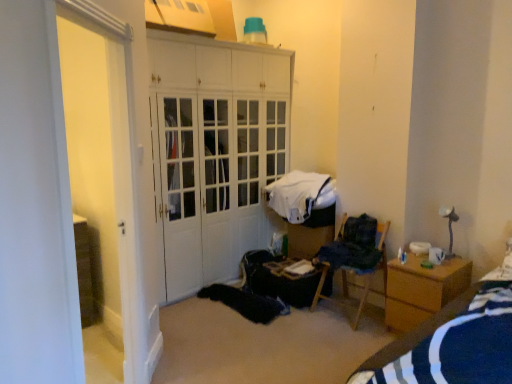
Question: From a real-world perspective, is wooden table at center over white glossy door at left?

Choices:
 (A) no
 (B) yes

Answer: (A)

Question: Is wooden table at center facing away from white glossy door at left?

Choices:
 (A) no
 (B) yes

Answer: (A)

Question: Is wooden table at center directly adjacent to white glossy door at left?

Choices:
 (A) yes
 (B) no

Answer: (B)

Question: Is wooden table at center shorter than white glossy door at left?

Choices:
 (A) no
 (B) yes

Answer: (B)

Question: Considering the relative positions of wooden table at center and white glossy door at left in the image provided, is wooden table at center in front of white glossy door at left?

Choices:
 (A) no
 (B) yes

Answer: (A)

Question: Is blue striped fabric at lower right situated inside dark blue fabric at right, positioned as the 1th clothing in front-to-back order, or outside?

Choices:
 (A) inside
 (B) outside

Answer: (B)

Question: Relative to dark blue fabric at right, the second clothing from the back, is blue striped fabric at lower right in front or behind?

Choices:
 (A) front
 (B) behind

Answer: (A)

Question: From a real-world perspective, is blue striped fabric at lower right physically located above or below dark blue fabric at right, the second clothing from the back?

Choices:
 (A) above
 (B) below

Answer: (B)

Question: Considering the positions of blue striped fabric at lower right and dark blue fabric at right, positioned as the 1th clothing in front-to-back order, in the image, is blue striped fabric at lower right taller or shorter than dark blue fabric at right, positioned as the 1th clothing in front-to-back order,?

Choices:
 (A) short
 (B) tall

Answer: (B)

Question: Is point (286, 213) closer or farther from the camera than point (136, 72)?

Choices:
 (A) farther
 (B) closer

Answer: (A)

Question: From the image's perspective, relative to white glossy door at left, is white fabric at center, arranged as the second clothing when viewed from the front, above or below?

Choices:
 (A) above
 (B) below

Answer: (A)

Question: Relative to white glossy door at left, is white fabric at center, arranged as the second clothing when viewed from the front, in front or behind?

Choices:
 (A) front
 (B) behind

Answer: (B)

Question: In terms of height, does white fabric at center, arranged as the second clothing when viewed from the front, look taller or shorter compared to white glossy door at left?

Choices:
 (A) tall
 (B) short

Answer: (B)

Question: From a real-world perspective, is wooden table at center positioned above or below dark blue fabric at right, positioned as the 1th clothing in front-to-back order?

Choices:
 (A) above
 (B) below

Answer: (B)

Question: Do you think wooden table at center is within dark blue fabric at right, the second clothing from the back, or outside of it?

Choices:
 (A) inside
 (B) outside

Answer: (B)